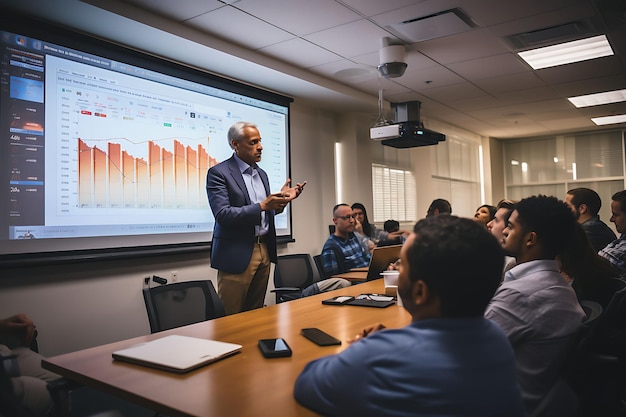
In order to click on overhead projector in this screenshot , I will do pyautogui.click(x=390, y=141), pyautogui.click(x=424, y=136), pyautogui.click(x=403, y=129), pyautogui.click(x=414, y=150).